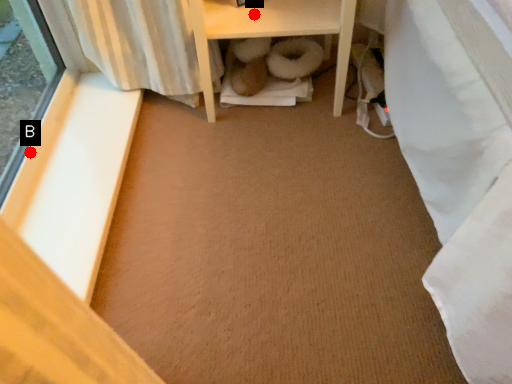
Question: Two points are circled on the image, labeled by A and B beside each circle. Which of the following is the closest to the observer?

Choices:
 (A) A is closer
 (B) B is closer

Answer: (B)